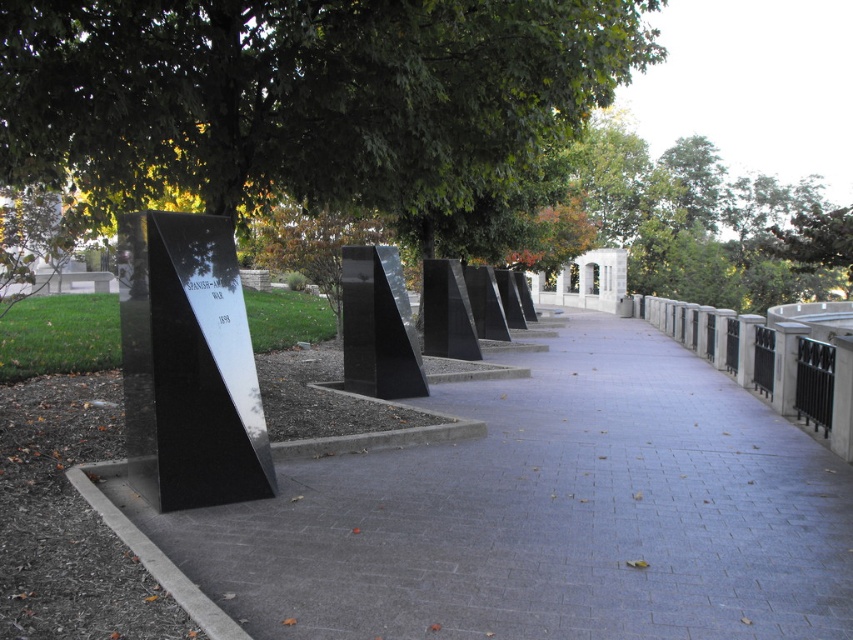
Looking at this image, you are a landscape architect planning to place a new rectangular garden bed between the gray concrete pavement at center and the black polished stone monument at center. Which object should the garden bed be placed closer to if it needs to be positioned near the larger one?

The gray concrete pavement at center is larger in size than the black polished stone monument at center, so the garden bed should be placed closer to the gray concrete pavement at center.

You are standing at the point marked with coordinates (532, 516) in the image. What material is the surface you are standing on made of?

The surface at point (532, 516) is gray concrete pavement.